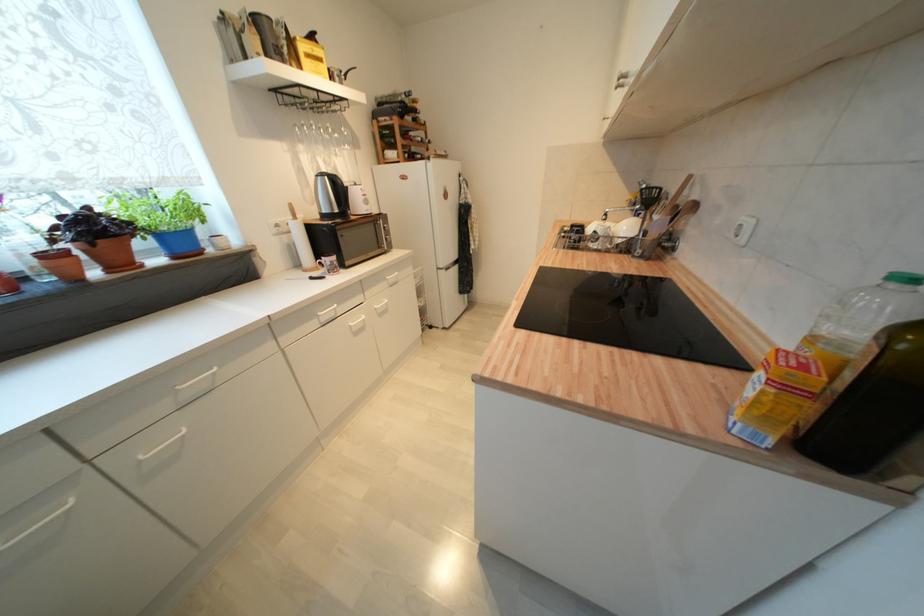
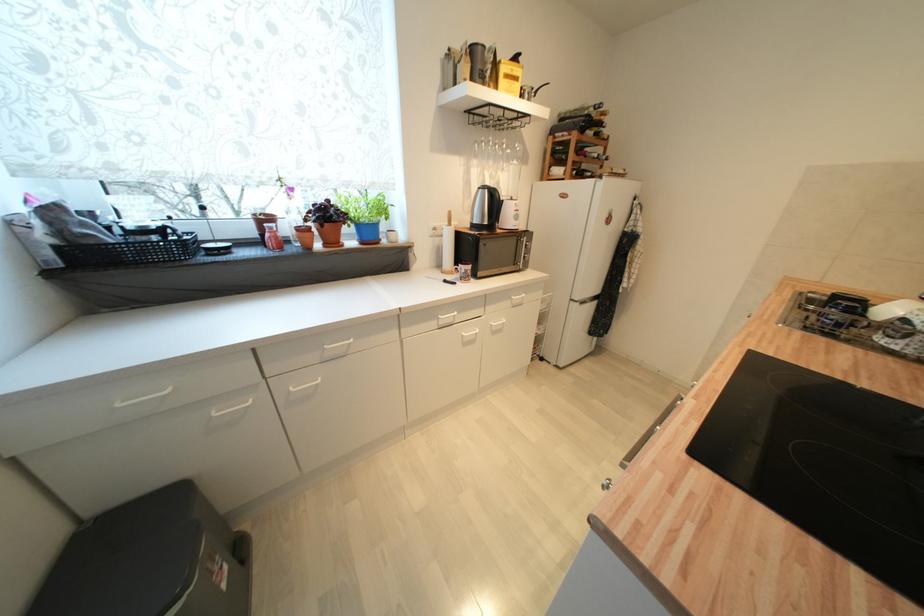
Locate, in the second image, the point that corresponds to point (306, 148) in the first image.

(480, 164)